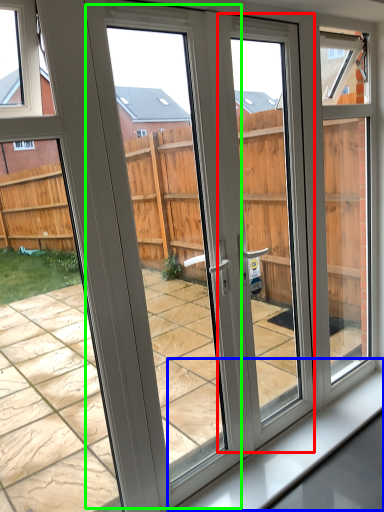
Question: Considering the real-world distances, which object is farthest from screen door (highlighted by a red box)? window sill (highlighted by a blue box) or screen door (highlighted by a green box)?

Choices:
 (A) window sill
 (B) screen door

Answer: (A)